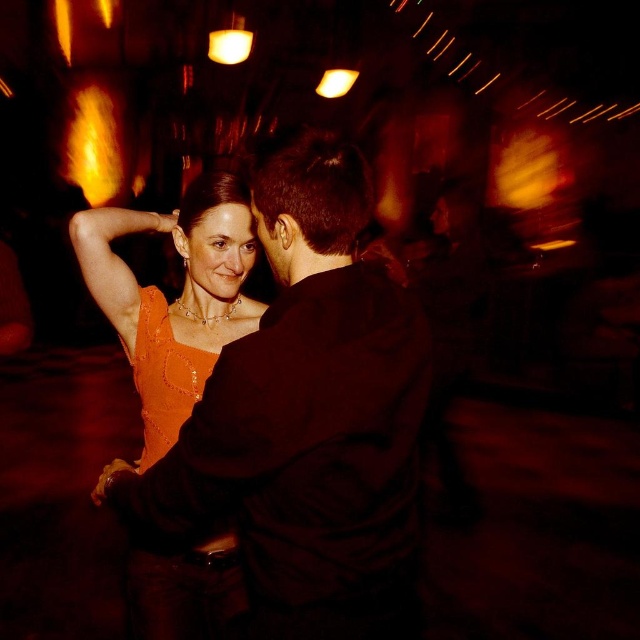
Can you confirm if matte black shirt at center is positioned to the left of shiny orange fabric dress at center?

In fact, matte black shirt at center is to the right of shiny orange fabric dress at center.

Between matte black shirt at center and shiny orange fabric dress at center, which one is positioned lower?

shiny orange fabric dress at center is below.

Locate an element on the screen. matte black shirt at center is located at coordinates (305, 419).

Based on the photo, which is below, orange sequined dress at center or shiny orange fabric dress at center?

shiny orange fabric dress at center is below.

Is orange sequined dress at center positioned before shiny orange fabric dress at center?

No, it is not.

The height and width of the screenshot is (640, 640). In order to click on orange sequined dress at center in this screenshot , I will do `click(176, 298)`.

Does matte black shirt at center have a smaller size compared to orange sequined dress at center?

No.

Does matte black shirt at center appear over orange sequined dress at center?

No.

Is point (326, 353) behind point (113, 220)?

No, it is in front of (113, 220).

Identify the location of matte black shirt at center. The width and height of the screenshot is (640, 640). (305, 419).